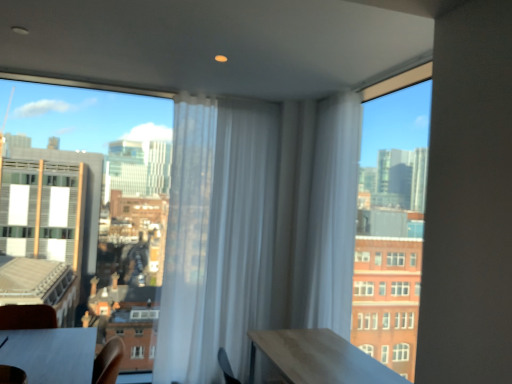
Question: Is transparent glass window at upper left, placed as the second window when sorted from right to left, taller than white sheer curtain at center, acting as the 2th curtain starting from the right?

Choices:
 (A) yes
 (B) no

Answer: (B)

Question: Does transparent glass window at upper left, the 1th window viewed from the left, appear on the left side of white sheer curtain at center, the first curtain positioned from the left?

Choices:
 (A) yes
 (B) no

Answer: (A)

Question: Considering the relative sizes of transparent glass window at upper left, placed as the second window when sorted from right to left, and white sheer curtain at center, the first curtain positioned from the left, in the image provided, is transparent glass window at upper left, placed as the second window when sorted from right to left, wider than white sheer curtain at center, the first curtain positioned from the left,?

Choices:
 (A) no
 (B) yes

Answer: (A)

Question: Does transparent glass window at upper left, the 1th window viewed from the left, have a larger size compared to white sheer curtain at center, the first curtain positioned from the left?

Choices:
 (A) no
 (B) yes

Answer: (B)

Question: Is transparent glass window at upper left, placed as the second window when sorted from right to left, oriented away from white sheer curtain at center, acting as the 2th curtain starting from the right?

Choices:
 (A) yes
 (B) no

Answer: (B)

Question: Is white sheer curtain at center, the 1th curtain when ordered from right to left, situated inside transparent glass window at upper left, placed as the second window when sorted from right to left, or outside?

Choices:
 (A) outside
 (B) inside

Answer: (A)

Question: From a real-world perspective, is white sheer curtain at center, the 1th curtain when ordered from right to left, above or below transparent glass window at upper left, the 1th window viewed from the left?

Choices:
 (A) above
 (B) below

Answer: (A)

Question: From the image's perspective, relative to transparent glass window at upper left, the 1th window viewed from the left, is white sheer curtain at center, acting as the second curtain starting from the left, above or below?

Choices:
 (A) above
 (B) below

Answer: (A)

Question: Considering the relative positions of white sheer curtain at center, the 1th curtain when ordered from right to left, and transparent glass window at upper left, the 1th window viewed from the left, in the image provided, is white sheer curtain at center, the 1th curtain when ordered from right to left, to the left or to the right of transparent glass window at upper left, the 1th window viewed from the left,?

Choices:
 (A) right
 (B) left

Answer: (A)

Question: From their relative heights in the image, would you say white sheer curtain at center, the 1th curtain when ordered from right to left, is taller or shorter than smooth wooden table at lower left?

Choices:
 (A) tall
 (B) short

Answer: (A)

Question: Considering the positions of point (334, 299) and point (45, 350), is point (334, 299) closer or farther from the camera than point (45, 350)?

Choices:
 (A) closer
 (B) farther

Answer: (B)

Question: Based on their positions, is white sheer curtain at center, acting as the second curtain starting from the left, located to the left or right of smooth wooden table at lower left?

Choices:
 (A) right
 (B) left

Answer: (A)

Question: In terms of size, does white sheer curtain at center, the 1th curtain when ordered from right to left, appear bigger or smaller than smooth wooden table at lower left?

Choices:
 (A) small
 (B) big

Answer: (B)

Question: From their relative heights in the image, would you say smooth wooden table at lower left is taller or shorter than transparent glass window at upper left, placed as the second window when sorted from right to left?

Choices:
 (A) tall
 (B) short

Answer: (B)

Question: In terms of size, does smooth wooden table at lower left appear bigger or smaller than transparent glass window at upper left, placed as the second window when sorted from right to left?

Choices:
 (A) big
 (B) small

Answer: (B)